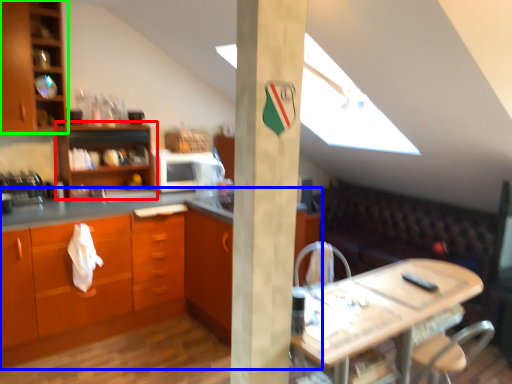
Question: Estimate the real-world distances between objects in this image. Which object is farther from shelf (highlighted by a red box), countertop (highlighted by a blue box) or cabinetry (highlighted by a green box)?

Choices:
 (A) countertop
 (B) cabinetry

Answer: (A)